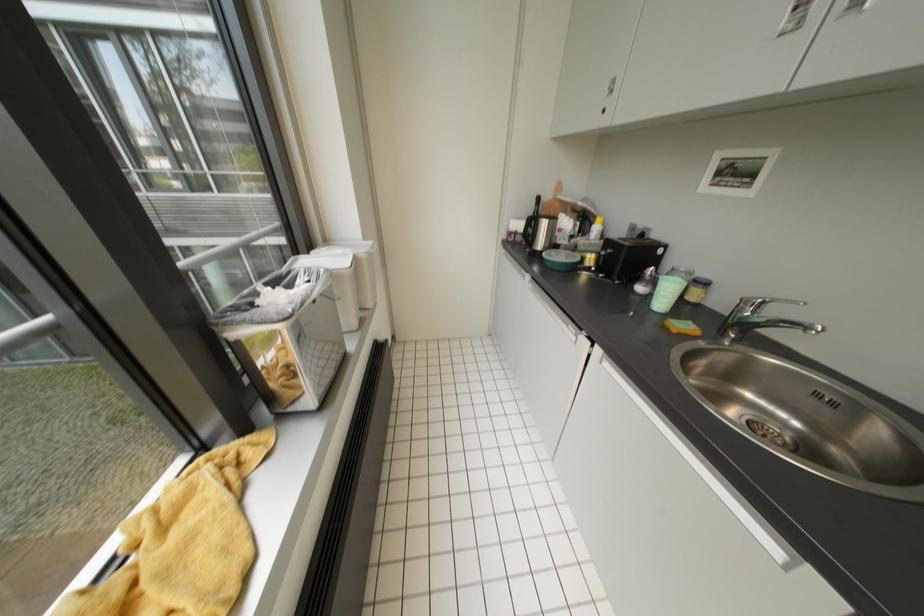
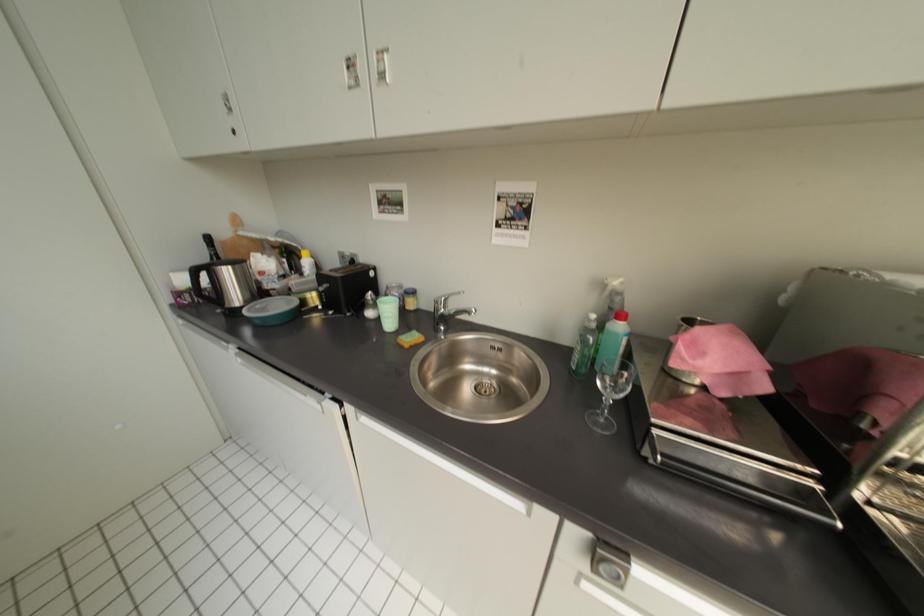
Question: How did the camera likely rotate?

Choices:
 (A) Left
 (B) Right
 (C) Up
 (D) Down

Answer: (B)